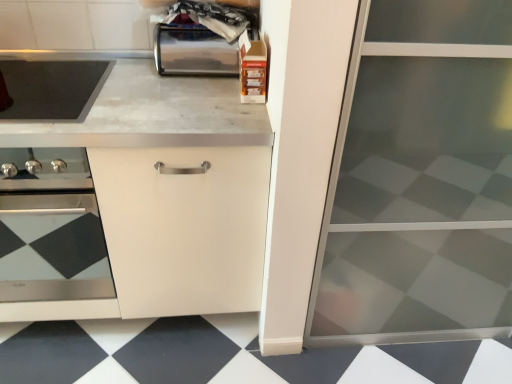
Question: Does shiny metallic toaster at upper center have a greater width compared to black glossy tile at lower center?

Choices:
 (A) no
 (B) yes

Answer: (A)

Question: Is black glossy tile at lower center completely or partially inside shiny metallic toaster at upper center?

Choices:
 (A) yes
 (B) no

Answer: (B)

Question: Can you confirm if shiny metallic toaster at upper center is smaller than black glossy tile at lower center?

Choices:
 (A) no
 (B) yes

Answer: (B)

Question: Considering the relative sizes of shiny metallic toaster at upper center and black glossy tile at lower center in the image provided, is shiny metallic toaster at upper center bigger than black glossy tile at lower center?

Choices:
 (A) no
 (B) yes

Answer: (A)

Question: Could you tell me if shiny metallic toaster at upper center is facing black glossy tile at lower center?

Choices:
 (A) no
 (B) yes

Answer: (A)

Question: Considering the relative positions of white marble countertop at center and shiny metallic toaster at upper center in the image provided, is white marble countertop at center to the left or to the right of shiny metallic toaster at upper center?

Choices:
 (A) right
 (B) left

Answer: (B)

Question: Would you say white marble countertop at center is inside or outside shiny metallic toaster at upper center?

Choices:
 (A) inside
 (B) outside

Answer: (B)

Question: Considering the positions of white marble countertop at center and shiny metallic toaster at upper center in the image, is white marble countertop at center wider or thinner than shiny metallic toaster at upper center?

Choices:
 (A) wide
 (B) thin

Answer: (A)

Question: Based on their sizes in the image, would you say white marble countertop at center is bigger or smaller than shiny metallic toaster at upper center?

Choices:
 (A) small
 (B) big

Answer: (B)

Question: Looking at the image, does white marble countertop at center seem bigger or smaller compared to matte black oven at left?

Choices:
 (A) big
 (B) small

Answer: (A)

Question: Is point click(x=168, y=312) positioned closer to the camera than point click(x=104, y=264)?

Choices:
 (A) closer
 (B) farther

Answer: (A)

Question: In the image, is white marble countertop at center positioned in front of or behind matte black oven at left?

Choices:
 (A) front
 (B) behind

Answer: (A)

Question: From a real-world perspective, is white marble countertop at center physically located above or below matte black oven at left?

Choices:
 (A) above
 (B) below

Answer: (B)

Question: Considering the relative positions of shiny metallic toaster at upper center and smooth black cooktop at upper left in the image provided, is shiny metallic toaster at upper center to the left or to the right of smooth black cooktop at upper left?

Choices:
 (A) left
 (B) right

Answer: (B)

Question: Relative to smooth black cooktop at upper left, is shiny metallic toaster at upper center in front or behind?

Choices:
 (A) front
 (B) behind

Answer: (B)